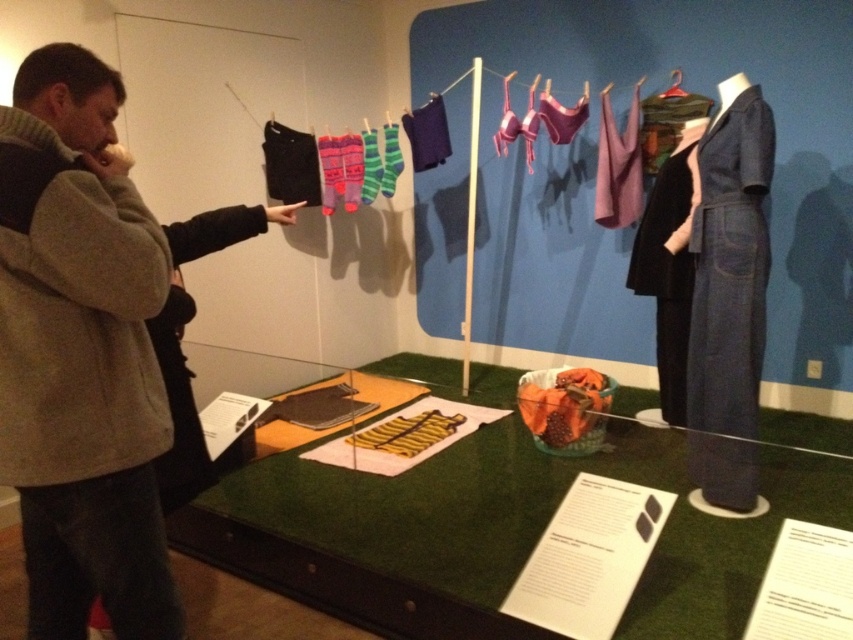
Is denim coat at right below black matte suit at right?

No, denim coat at right is not below black matte suit at right.

Who is lower down, denim coat at right or black matte suit at right?

black matte suit at right is below.

Locate an element on the screen. denim coat at right is located at coordinates (730, 262).

Find the location of a particular element. denim coat at right is located at coordinates (730, 262).

Does green felt table at center have a greater height compared to denim coat at right?

Incorrect, green felt table at center's height is not larger of denim coat at right's.

Which is in front, point (421, 557) or point (747, 208)?

Point (421, 557)

Is point (491, 598) closer to viewer compared to point (704, 493)?

Yes.

Locate an element on the screen. The width and height of the screenshot is (853, 640). green felt table at center is located at coordinates (496, 529).

Can you confirm if matte black jacket at left is bigger than black matte suit at right?

Indeed, matte black jacket at left has a larger size compared to black matte suit at right.

Can you confirm if matte black jacket at left is thinner than black matte suit at right?

In fact, matte black jacket at left might be wider than black matte suit at right.

Between point (26, 145) and point (683, 376), which one is positioned behind?

The point (683, 376) is behind.

Locate an element on the screen. matte black jacket at left is located at coordinates (77, 365).